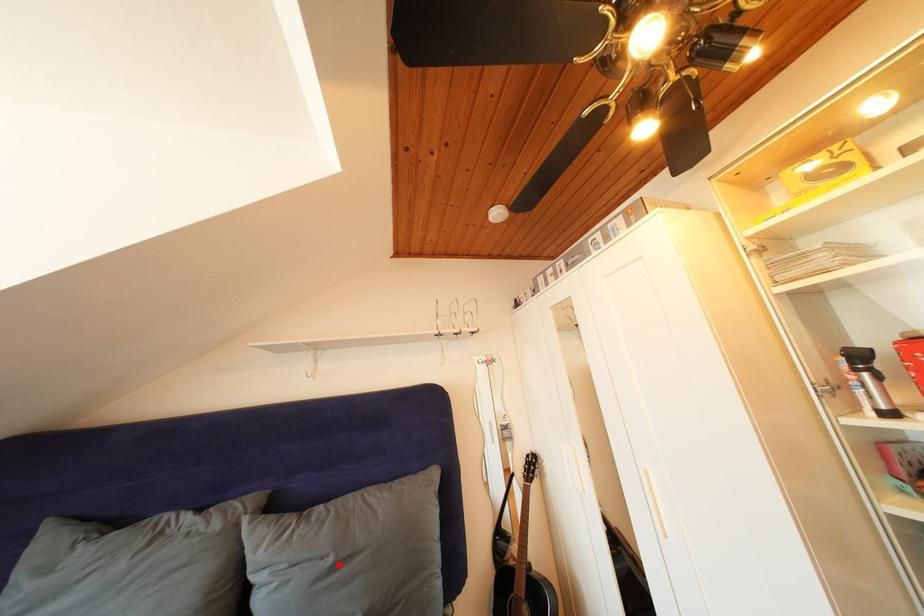
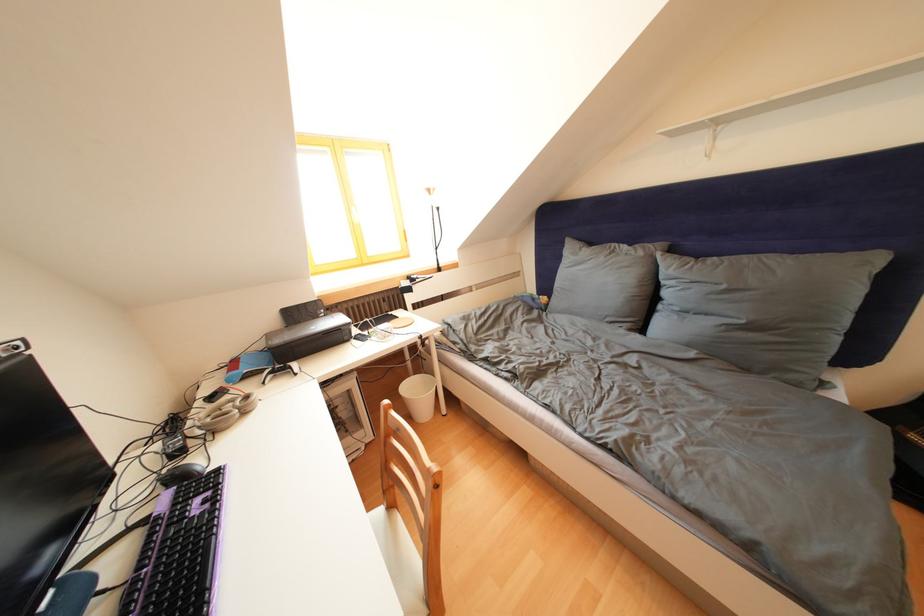
Find the pixel in the second image that matches the highlighted location in the first image.

(733, 292)